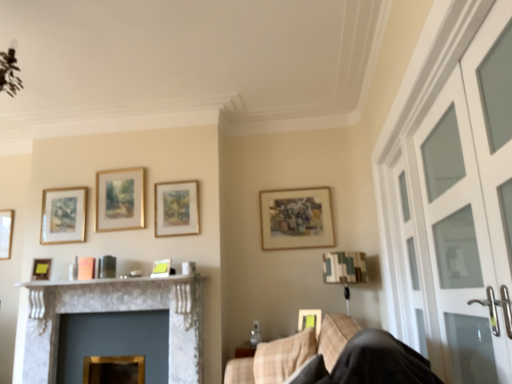
Describe the element at coordinates (63, 215) in the screenshot. I see `matte gold picture frame at upper left, marked as the 6th picture frame in a right-to-left arrangement` at that location.

At what (x,y) coordinates should I click in order to perform the action: click on matte gold picture frame at upper left, which ranks as the third picture frame in left-to-right order. Please return your answer as a coordinate pair (x, y). Looking at the image, I should click on (63, 215).

In the scene shown: How much space does matte gold picture frame at upper center, which appears as the second picture frame when viewed from the right, occupy vertically?

The height of matte gold picture frame at upper center, which appears as the second picture frame when viewed from the right, is 22.56 inches.

Measure the distance between point (415, 311) and camera.

Point (415, 311) is 2.85 meters away from camera.

Find the location of a particular element. This screenshot has width=512, height=384. matte green picture frame at center, acting as the eighth picture frame starting from the left is located at coordinates (310, 320).

This screenshot has height=384, width=512. What do you see at coordinates (310, 320) in the screenshot? I see `matte green picture frame at center, which ranks as the first picture frame in right-to-left order` at bounding box center [310, 320].

How much space does gold-framed picture at center, marked as the 3th picture frame in a right-to-left arrangement, occupy vertically?

It is 19.89 inches.

Locate an element on the screen. Image resolution: width=512 pixels, height=384 pixels. gold-framed picture at center, the sixth picture frame from the left is located at coordinates (176, 208).

The height and width of the screenshot is (384, 512). I want to click on matte gold picture frame at upper left, which ranks as the third picture frame in left-to-right order, so click(x=63, y=215).

Considering the sizes of objects gold-framed picture at upper center, which appears as the fifth picture frame when viewed from the right, and beige fabric swivel chair at lower right in the image provided, who is thinner, gold-framed picture at upper center, which appears as the fifth picture frame when viewed from the right, or beige fabric swivel chair at lower right?

Thinner between the two is gold-framed picture at upper center, which appears as the fifth picture frame when viewed from the right.

What's the angular difference between gold-framed picture at upper center, which appears as the fifth picture frame when viewed from the right, and beige fabric swivel chair at lower right's facing directions?

The angle between the facing direction of gold-framed picture at upper center, which appears as the fifth picture frame when viewed from the right, and the facing direction of beige fabric swivel chair at lower right is 91.1 degrees.

Is gold-framed picture at upper center, marked as the 4th picture frame in a left-to-right arrangement, inside or outside of beige fabric swivel chair at lower right?

gold-framed picture at upper center, marked as the 4th picture frame in a left-to-right arrangement, is not inside beige fabric swivel chair at lower right, it's outside.

Does gold-framed picture at upper center, marked as the 4th picture frame in a left-to-right arrangement, have a larger size compared to beige fabric swivel chair at lower right?

No, gold-framed picture at upper center, marked as the 4th picture frame in a left-to-right arrangement, is not bigger than beige fabric swivel chair at lower right.

From a real-world perspective, who is located higher, clear glass screen door at right, placed as the second screen door when sorted from front to back, or white marble mantle at center?

clear glass screen door at right, placed as the second screen door when sorted from front to back, is physically above.

Can you confirm if clear glass screen door at right, which is the first screen door from back to front, is smaller than white marble mantle at center?

Incorrect, clear glass screen door at right, which is the first screen door from back to front, is not smaller in size than white marble mantle at center.

Is clear glass screen door at right, placed as the second screen door when sorted from front to back, at the right side of white marble mantle at center?

Yes.

Is clear glass screen door at right, placed as the second screen door when sorted from front to back, far away from white marble mantle at center?

clear glass screen door at right, placed as the second screen door when sorted from front to back, is positioned a significant distance from white marble mantle at center.

Can you confirm if matte gold picture frame at upper center, the seventh picture frame positioned from the left, is bigger than gold-framed picture at upper center, marked as the 4th picture frame in a left-to-right arrangement?

Yes, matte gold picture frame at upper center, the seventh picture frame positioned from the left, is bigger than gold-framed picture at upper center, marked as the 4th picture frame in a left-to-right arrangement.

Which is more to the right, matte gold picture frame at upper center, the seventh picture frame positioned from the left, or gold-framed picture at upper center, which appears as the fifth picture frame when viewed from the right?

From the viewer's perspective, matte gold picture frame at upper center, the seventh picture frame positioned from the left, appears more on the right side.

Considering the sizes of objects matte gold picture frame at upper center, which appears as the second picture frame when viewed from the right, and gold-framed picture at upper center, which appears as the fifth picture frame when viewed from the right, in the image provided, who is wider, matte gold picture frame at upper center, which appears as the second picture frame when viewed from the right, or gold-framed picture at upper center, which appears as the fifth picture frame when viewed from the right,?

matte gold picture frame at upper center, which appears as the second picture frame when viewed from the right.

Is beige fabric swivel chair at lower right positioned with its back to matte gold picture frame at left, arranged as the second picture frame when viewed from the left?

beige fabric swivel chair at lower right does not have its back to matte gold picture frame at left, arranged as the second picture frame when viewed from the left.

Which is in front, beige fabric swivel chair at lower right or matte gold picture frame at left, arranged as the second picture frame when viewed from the left?

beige fabric swivel chair at lower right.

Is beige fabric swivel chair at lower right beside matte gold picture frame at left, arranged as the second picture frame when viewed from the left?

No, beige fabric swivel chair at lower right is not in contact with matte gold picture frame at left, arranged as the second picture frame when viewed from the left.

From the picture: Considering the sizes of objects clear glass screen door at right, placed as the second screen door when sorted from front to back, and white marble fireplace at left in the image provided, who is smaller, clear glass screen door at right, placed as the second screen door when sorted from front to back, or white marble fireplace at left?

clear glass screen door at right, placed as the second screen door when sorted from front to back, is smaller.

Can you confirm if clear glass screen door at right, placed as the second screen door when sorted from front to back, is shorter than white marble fireplace at left?

In fact, clear glass screen door at right, placed as the second screen door when sorted from front to back, may be taller than white marble fireplace at left.

Considering the relative positions of camouflage fabric lampshade at upper right and matte yellow picture frame at center, the fourth picture frame when ordered from right to left, in the image provided, is camouflage fabric lampshade at upper right to the right of matte yellow picture frame at center, the fourth picture frame when ordered from right to left, from the viewer's perspective?

Yes, camouflage fabric lampshade at upper right is to the right of matte yellow picture frame at center, the fourth picture frame when ordered from right to left.

Considering the relative sizes of camouflage fabric lampshade at upper right and matte yellow picture frame at center, the fourth picture frame when ordered from right to left, in the image provided, is camouflage fabric lampshade at upper right wider than matte yellow picture frame at center, the fourth picture frame when ordered from right to left,?

Correct, the width of camouflage fabric lampshade at upper right exceeds that of matte yellow picture frame at center, the fourth picture frame when ordered from right to left.

Is the position of camouflage fabric lampshade at upper right less distant than that of matte yellow picture frame at center, the fourth picture frame when ordered from right to left?

Yes, camouflage fabric lampshade at upper right is closer to the camera.

From a real-world perspective, is camouflage fabric lampshade at upper right positioned under matte yellow picture frame at center, which appears as the 5th picture frame when viewed from the left, based on gravity?

Yes.

Considering the sizes of objects camouflage fabric lampshade at upper right and matte gold picture frame at left, arranged as the second picture frame when viewed from the left, in the image provided, who is smaller, camouflage fabric lampshade at upper right or matte gold picture frame at left, arranged as the second picture frame when viewed from the left,?

With smaller size is matte gold picture frame at left, arranged as the second picture frame when viewed from the left.

Consider the image. Considering the positions of objects camouflage fabric lampshade at upper right and matte gold picture frame at left, which is the 7th picture frame in right-to-left order, in the image provided, who is in front, camouflage fabric lampshade at upper right or matte gold picture frame at left, which is the 7th picture frame in right-to-left order,?

camouflage fabric lampshade at upper right is closer to the camera.

What's the angular difference between camouflage fabric lampshade at upper right and matte gold picture frame at left, which is the 7th picture frame in right-to-left order,'s facing directions?

24.6 degrees.

Is camouflage fabric lampshade at upper right placed right next to matte gold picture frame at left, arranged as the second picture frame when viewed from the left?

No, camouflage fabric lampshade at upper right is not next to matte gold picture frame at left, arranged as the second picture frame when viewed from the left.

You are a GUI agent. You are given a task and a screenshot of the screen. Output one action in this format:
    pyautogui.click(x=<x>, y=<y>)
    Task: Click on the picture frame that is the 3rd object to the left of the beige fabric swivel chair at lower right, starting at the anchor
    This screenshot has width=512, height=384.
    Given the screenshot: What is the action you would take?
    pyautogui.click(x=120, y=199)

Locate an element on the screen. screen door that is the 2nd one above the white marble mantle at center (from a real-world perspective) is located at coordinates (409, 247).

Which object lies further to the anchor point matte yellow picture frame at center, which appears as the 5th picture frame when viewed from the left, gold-framed picture at upper center, marked as the 4th picture frame in a left-to-right arrangement, or matte gold picture frame at left, which is the 7th picture frame in right-to-left order?

Based on the image, matte gold picture frame at left, which is the 7th picture frame in right-to-left order, appears to be further to matte yellow picture frame at center, which appears as the 5th picture frame when viewed from the left.

From the image, which object appears to be nearer to matte yellow picture frame at center, which appears as the 5th picture frame when viewed from the left, matte gold picture frame at upper center, which appears as the second picture frame when viewed from the right, or clear glass screen door at right, which is the first screen door from back to front?

matte gold picture frame at upper center, which appears as the second picture frame when viewed from the right, is closer to matte yellow picture frame at center, which appears as the 5th picture frame when viewed from the left.

Considering their positions, is white frosted glass screen door at right, acting as the 2th screen door starting from the back, positioned further to gold-framed picture at center, the sixth picture frame from the left, than beige fabric swivel chair at lower right?

white frosted glass screen door at right, acting as the 2th screen door starting from the back, is further to gold-framed picture at center, the sixth picture frame from the left.

Considering their positions, is matte gold picture frame at upper center, which appears as the second picture frame when viewed from the right, positioned closer to plaid fabric chair at lower right than matte yellow picture frame at center, which appears as the 5th picture frame when viewed from the left?

The object closer to plaid fabric chair at lower right is matte yellow picture frame at center, which appears as the 5th picture frame when viewed from the left.

Looking at the image, which one is located further to beige fabric swivel chair at lower right, camouflage fabric lampshade at upper right or white marble fireplace at left?

white marble fireplace at left.

Considering their positions, is gold-framed picture at upper center, marked as the 4th picture frame in a left-to-right arrangement, positioned further to camouflage fabric lampshade at upper right than matte yellow picture frame at center, the fourth picture frame when ordered from right to left?

Based on the image, gold-framed picture at upper center, marked as the 4th picture frame in a left-to-right arrangement, appears to be further to camouflage fabric lampshade at upper right.

From the image, which object appears to be nearer to gold-framed picture at center, the sixth picture frame from the left, matte yellow picture frame at center, which appears as the 5th picture frame when viewed from the left, or wooden picture frame at left, which ranks as the 8th picture frame in right-to-left order?

Based on the image, matte yellow picture frame at center, which appears as the 5th picture frame when viewed from the left, appears to be nearer to gold-framed picture at center, the sixth picture frame from the left.

Which object lies nearer to the anchor point gold-framed picture at upper center, marked as the 4th picture frame in a left-to-right arrangement, wooden picture frame at left, marked as the first picture frame in a left-to-right arrangement, or matte gold picture frame at upper center, which appears as the second picture frame when viewed from the right?

matte gold picture frame at upper center, which appears as the second picture frame when viewed from the right, is closer to gold-framed picture at upper center, marked as the 4th picture frame in a left-to-right arrangement.

Where is `chair between white marble mantle at center and white frosted glass screen door at right, the first screen door in the front-to-back sequence`? This screenshot has height=384, width=512. chair between white marble mantle at center and white frosted glass screen door at right, the first screen door in the front-to-back sequence is located at coordinates (333, 358).

At what (x,y) coordinates should I click in order to perform the action: click on swivel chair located between plaid fabric chair at lower right and clear glass screen door at right, placed as the second screen door when sorted from front to back, in the depth direction. Please return your answer as a coordinate pair (x, y). Looking at the image, I should click on (273, 360).

Identify the location of chair located between beige fabric swivel chair at lower right and white frosted glass screen door at right, acting as the 2th screen door starting from the back, in the left-right direction. The width and height of the screenshot is (512, 384). (333, 358).

Image resolution: width=512 pixels, height=384 pixels. What are the coordinates of `mantle between gold-framed picture at upper center, which appears as the fifth picture frame when viewed from the right, and camouflage fabric lampshade at upper right` in the screenshot? It's located at (116, 282).